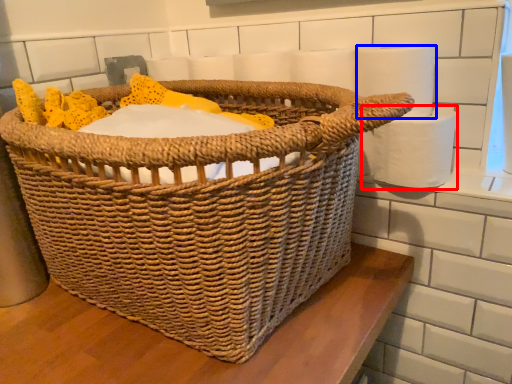
Question: Which of the following is the farthest to the observer, toilet paper (highlighted by a red box) or toilet paper (highlighted by a blue box)?

Choices:
 (A) toilet paper
 (B) toilet paper

Answer: (A)